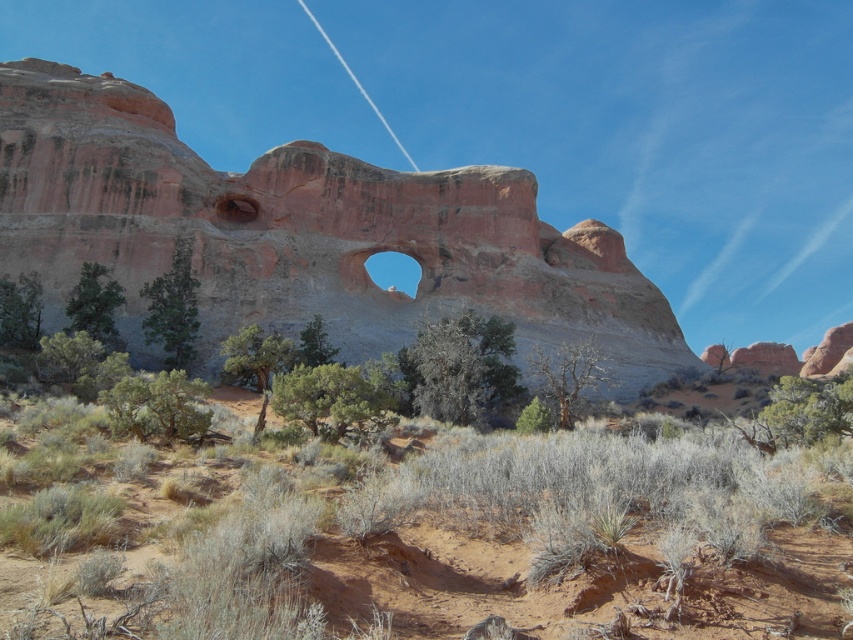
You are a photographer planning to capture the desert shrubs at center and the rustic stone hole at center in a single frame. Based on their sizes, which object would occupy more space in your photo?

The desert shrubs at center would occupy more space in the photo because their width is larger than that of the rustic stone hole at center.

You are standing in front of the large rock formation with the arch. You want to place a small flag exactly halfway between the desert shrubs at center and the rustic stone hole at center. Which object will the flag be closer to?

The flag will be closer to the desert shrubs at center because it is closer to the viewer than the rustic stone hole at center, so the midpoint between them would be nearer to the shrubs.